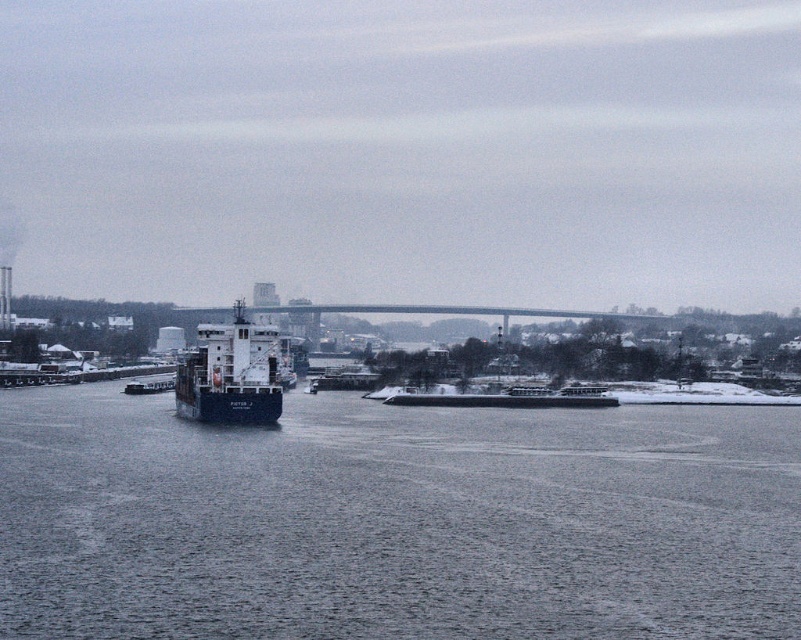
Question: In this image, where is gray water at center located relative to white matte barge at center?

Choices:
 (A) right
 (B) left

Answer: (B)

Question: Which object is positioned farthest from the white matte barge at center?

Choices:
 (A) gray water at center
 (B) blue matte cargo ship at center

Answer: (A)

Question: Which point appears farthest from the camera in this image?

Choices:
 (A) (73, 602)
 (B) (449, 403)

Answer: (B)

Question: Which is farther from the blue matte cargo ship at center?

Choices:
 (A) white matte barge at center
 (B) gray water at center

Answer: (B)

Question: Observing the image, what is the correct spatial positioning of blue matte cargo ship at center in reference to white matte barge at center?

Choices:
 (A) right
 (B) left

Answer: (B)

Question: Does blue matte cargo ship at center have a lesser width compared to white matte barge at center?

Choices:
 (A) no
 (B) yes

Answer: (A)